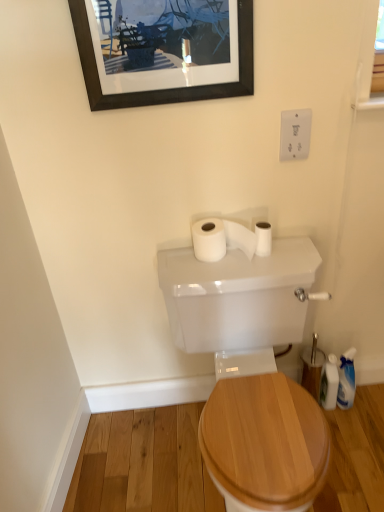
This screenshot has height=512, width=384. What are the coordinates of `vacant space to the right of white plastic bottle at lower right` in the screenshot? It's located at (365, 409).